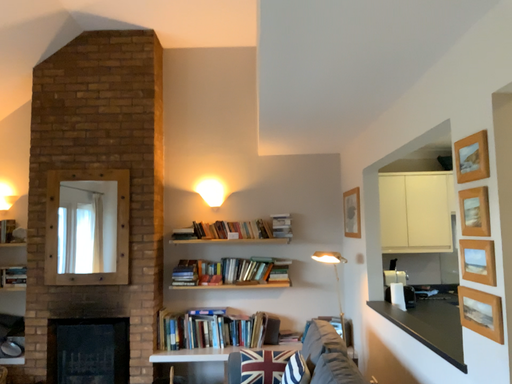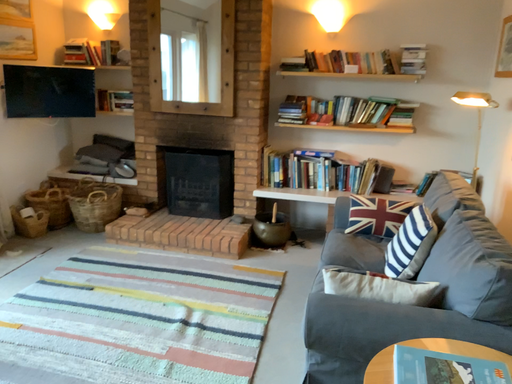
Question: Which way did the camera rotate in the video?

Choices:
 (A) rotated left
 (B) rotated right

Answer: (A)